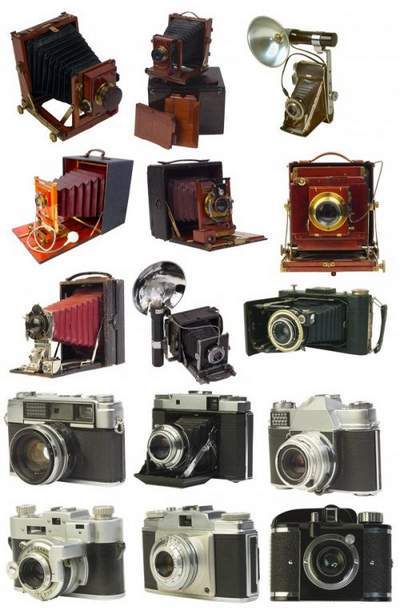
The image size is (400, 610). In order to click on door in this screenshot , I will do `click(160, 482)`, `click(217, 371)`, `click(69, 370)`, `click(258, 321)`, `click(230, 241)`, `click(64, 243)`, `click(322, 259)`, `click(298, 127)`.